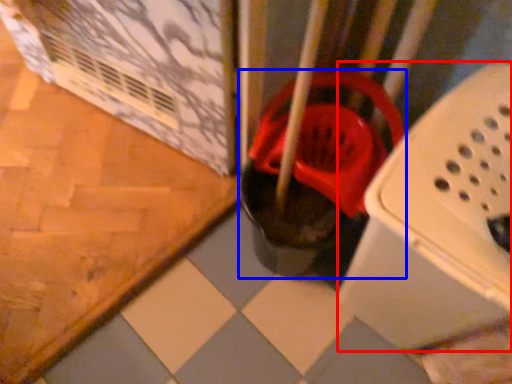
Question: Which of the following is the closest to the observer, box (highlighted by a red box) or footwear (highlighted by a blue box)?

Choices:
 (A) box
 (B) footwear

Answer: (A)